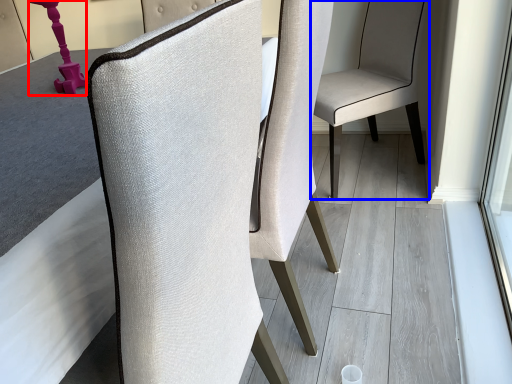
Question: Which of the following is the farthest to the observer, table lamp (highlighted by a red box) or chair (highlighted by a blue box)?

Choices:
 (A) table lamp
 (B) chair

Answer: (B)